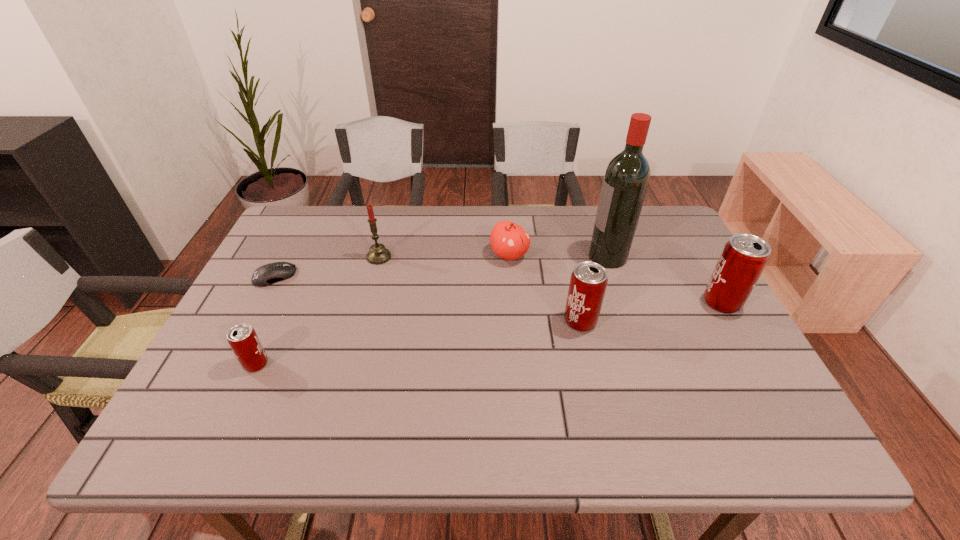
Locate an element on the screen. vacant space located 0.310m on the back of the shortest beer can is located at coordinates (300, 268).

Locate an element on the screen. The height and width of the screenshot is (540, 960). free space located on the back of the second shortest beer can is located at coordinates (572, 286).

This screenshot has width=960, height=540. I want to click on vacant space positioned on the front of the rightmost beer can, so click(x=756, y=364).

Find the location of a particular element. The height and width of the screenshot is (540, 960). free space located 0.300m on the left of the apple is located at coordinates (388, 255).

Identify the location of vacant area located on the label of the tallest object. (487, 256).

At what (x,y) coordinates should I click in order to perform the action: click on vacant area situated on the label of the tallest object. Please return your answer as a coordinate pair (x, y). The width and height of the screenshot is (960, 540). Looking at the image, I should click on (490, 256).

Where is `free location located on the label of the tallest object`? Image resolution: width=960 pixels, height=540 pixels. free location located on the label of the tallest object is located at coordinates (490, 256).

Locate an element on the screen. vacant space situated on the right of the candle is located at coordinates coord(517,257).

The image size is (960, 540). Find the location of `vacant space positioned 0.260m on the front of the computer equipment`. vacant space positioned 0.260m on the front of the computer equipment is located at coordinates (228, 366).

What are the coordinates of `apple that is positioned at the far edge` in the screenshot? It's located at (509, 241).